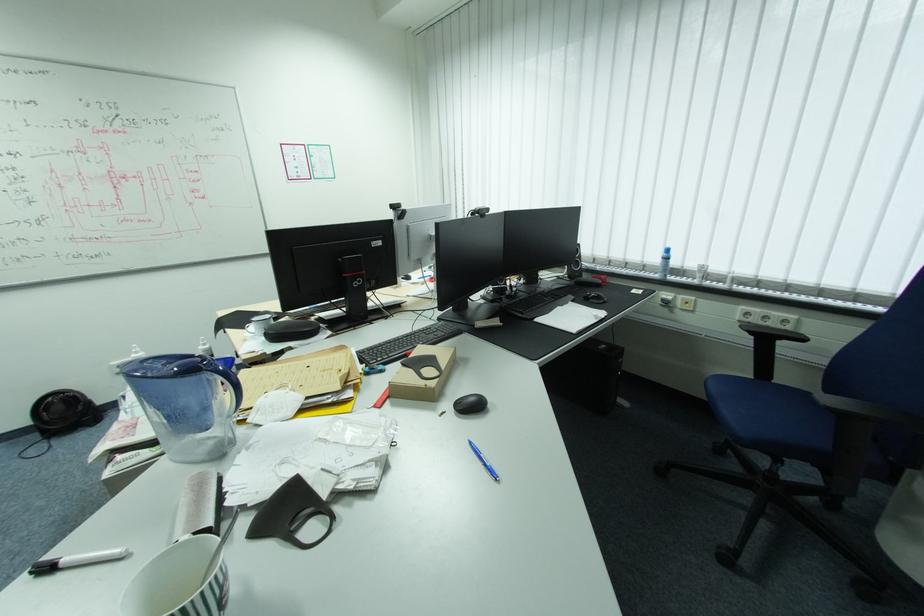
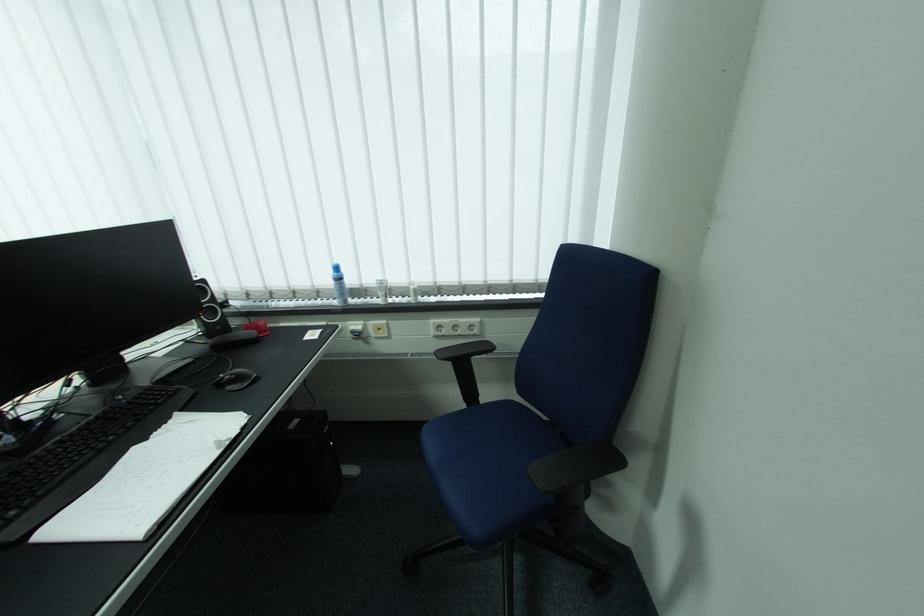
The point at (604,297) is marked in the first image. Where is the corresponding point in the second image?

(245, 379)